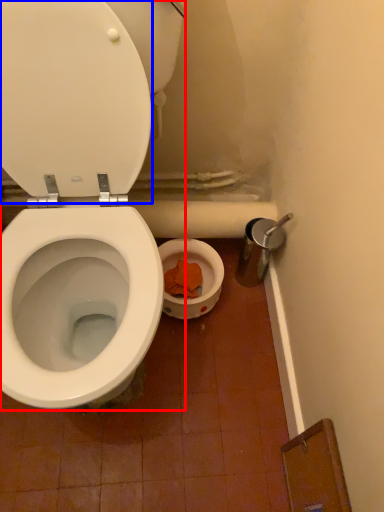
Question: Which object appears farthest to the camera in this image, toilet (highlighted by a red box) or lid (highlighted by a blue box)?

Choices:
 (A) toilet
 (B) lid

Answer: (B)